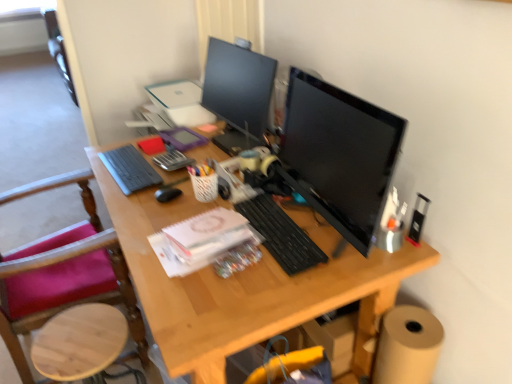
The height and width of the screenshot is (384, 512). I want to click on vacant space situated above wooden at left (from a real-world perspective), so 79,334.